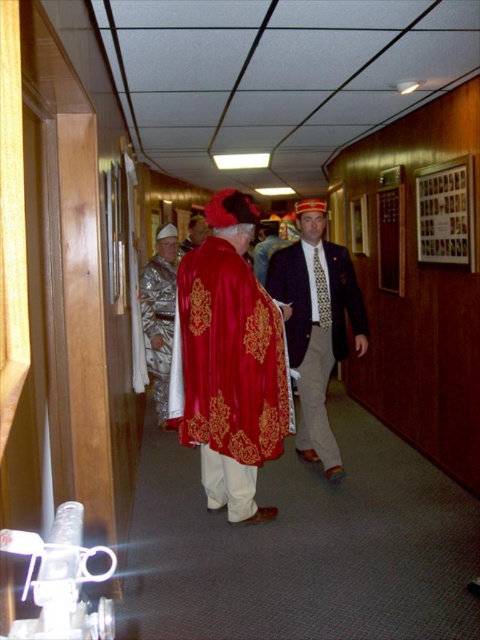
Question: Estimate the real-world distances between objects in this image. Which object is farther from the velvet red cape at center?

Choices:
 (A) velvet gold robe at center
 (B) velvet gold at center

Answer: (B)

Question: Can you confirm if velvet gold at center is thinner than velvet gold robe at center?

Choices:
 (A) no
 (B) yes

Answer: (A)

Question: Can you confirm if velvet gold at center is positioned above velvet suit at center?

Choices:
 (A) no
 (B) yes

Answer: (A)

Question: Which of the following is the farthest from the observer?

Choices:
 (A) (188, 236)
 (B) (301, 285)
 (C) (178, 289)

Answer: (A)

Question: Among these points, which one is nearest to the camera?

Choices:
 (A) (159, 310)
 (B) (222, 387)
 (C) (308, 410)
 (D) (201, 220)

Answer: (B)

Question: Is velvet gold at center to the right of velvet gold robe at center from the viewer's perspective?

Choices:
 (A) yes
 (B) no

Answer: (A)